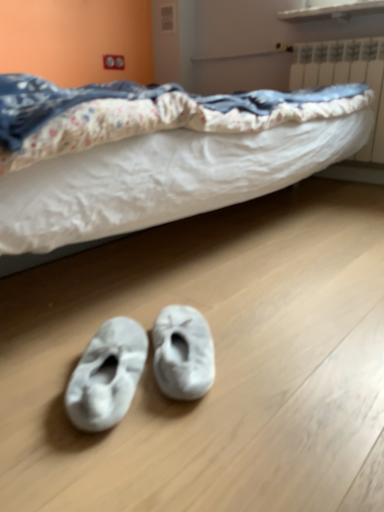
Question: Is white fuzzy slippers at lower center, the 1th footwear viewed from the right, smaller than white plastic radiator at upper right?

Choices:
 (A) yes
 (B) no

Answer: (A)

Question: From a real-world perspective, does white fuzzy slippers at lower center, the 1th footwear viewed from the right, stand above white plastic radiator at upper right?

Choices:
 (A) no
 (B) yes

Answer: (A)

Question: Does white fuzzy slippers at lower center, the second footwear viewed from the left, have a greater height compared to white plastic radiator at upper right?

Choices:
 (A) yes
 (B) no

Answer: (B)

Question: From a real-world perspective, does white fuzzy slippers at lower center, the 1th footwear viewed from the right, sit lower than white plastic radiator at upper right?

Choices:
 (A) no
 (B) yes

Answer: (B)

Question: Are white fuzzy slippers at lower center, the second footwear viewed from the left, and white plastic radiator at upper right making contact?

Choices:
 (A) yes
 (B) no

Answer: (B)

Question: Relative to white fuzzy slippers at lower center, the second footwear viewed from the left, is white fuzzy slippers at lower center, which is the second footwear from right to left, in front or behind?

Choices:
 (A) behind
 (B) front

Answer: (B)

Question: From the image's perspective, is white fuzzy slippers at lower center, the 1th footwear positioned from the left, positioned above or below white fuzzy slippers at lower center, the second footwear viewed from the left?

Choices:
 (A) above
 (B) below

Answer: (B)

Question: Is white fuzzy slippers at lower center, which is the second footwear from right to left, inside or outside of white fuzzy slippers at lower center, the 1th footwear viewed from the right?

Choices:
 (A) inside
 (B) outside

Answer: (B)

Question: Is point (102, 366) positioned closer to the camera than point (201, 362)?

Choices:
 (A) farther
 (B) closer

Answer: (B)

Question: In terms of width, does white fuzzy slippers at lower center, the second footwear viewed from the left, look wider or thinner when compared to white fuzzy slippers at lower center, which is the second footwear from right to left?

Choices:
 (A) thin
 (B) wide

Answer: (A)

Question: From a real-world perspective, is white fuzzy slippers at lower center, the 1th footwear viewed from the right, physically located above or below white fuzzy slippers at lower center, which is the second footwear from right to left?

Choices:
 (A) above
 (B) below

Answer: (A)

Question: Considering the positions of white fuzzy slippers at lower center, the 1th footwear viewed from the right, and white fuzzy slippers at lower center, the 1th footwear positioned from the left, in the image, is white fuzzy slippers at lower center, the 1th footwear viewed from the right, taller or shorter than white fuzzy slippers at lower center, the 1th footwear positioned from the left,?

Choices:
 (A) short
 (B) tall

Answer: (B)

Question: In terms of size, does white fuzzy slippers at lower center, the 1th footwear viewed from the right, appear bigger or smaller than white fuzzy slippers at lower center, which is the second footwear from right to left?

Choices:
 (A) big
 (B) small

Answer: (B)

Question: From a real-world perspective, relative to white plastic radiator at upper right, is white fuzzy slippers at lower center, the 1th footwear positioned from the left, vertically above or below?

Choices:
 (A) above
 (B) below

Answer: (B)

Question: Is white fuzzy slippers at lower center, which is the second footwear from right to left, spatially inside white plastic radiator at upper right, or outside of it?

Choices:
 (A) inside
 (B) outside

Answer: (B)